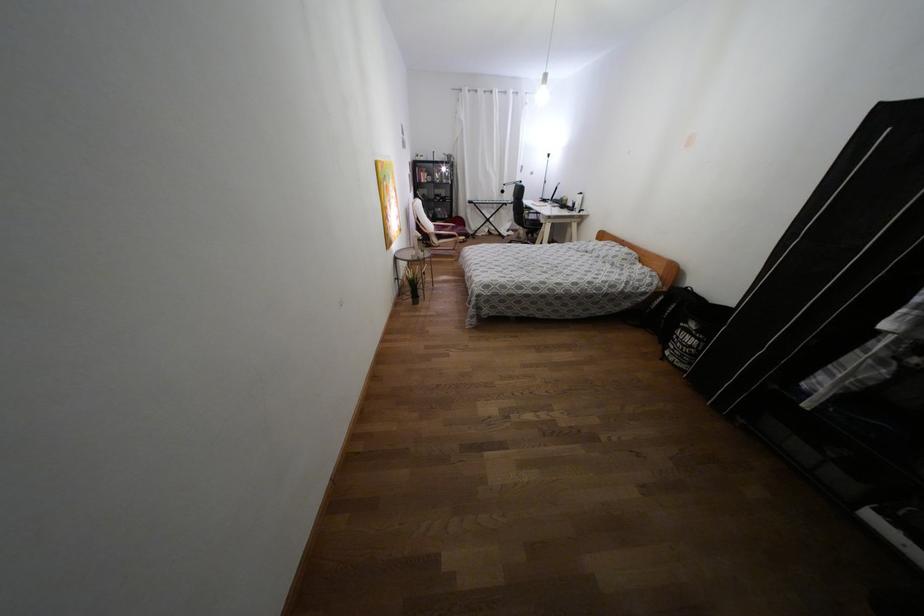
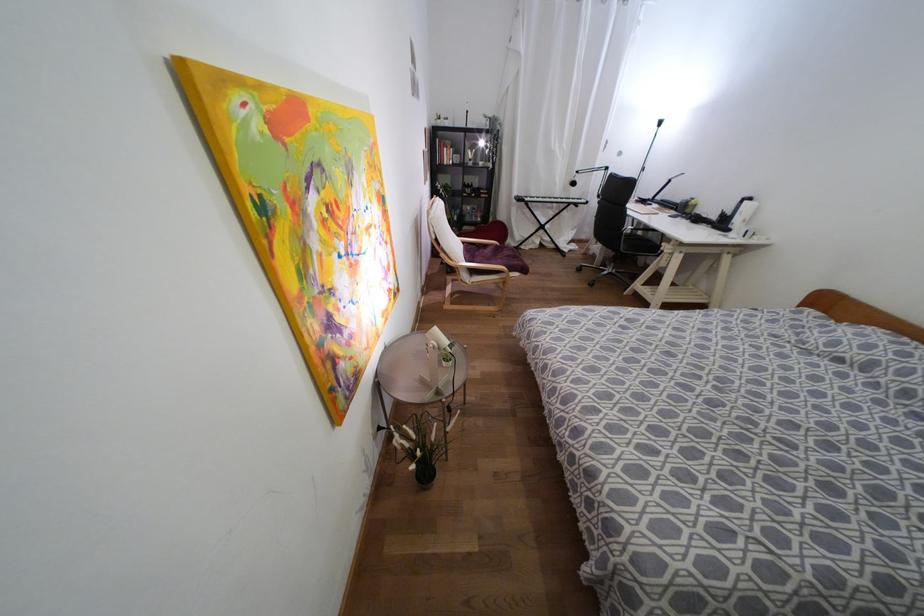
Question: The images are taken continuously from a first-person perspective. In which direction are you moving?

Choices:
 (A) Left
 (B) Right
 (C) Forward
 (D) Backward

Answer: (C)